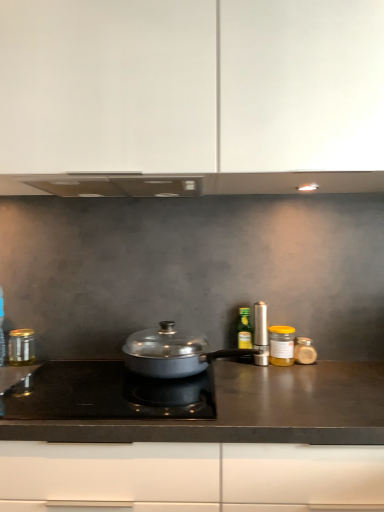
Locate an element on the screen. Image resolution: width=384 pixels, height=512 pixels. vacant space underneath white matte cabinet at upper center (from a real-world perspective) is located at coordinates (196, 387).